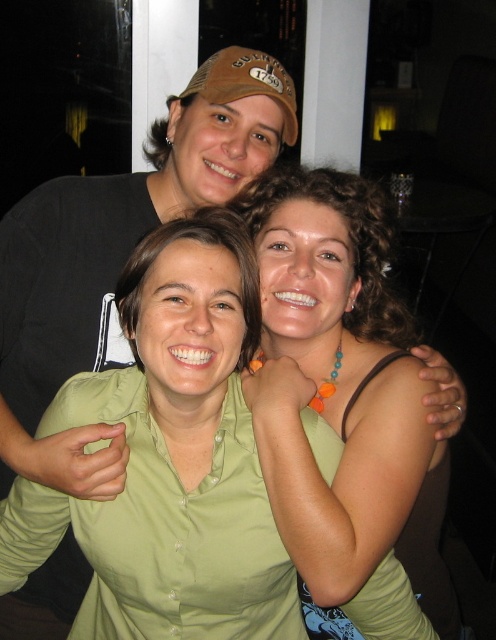
You are trying to take a photo of the brown fabric baseball cap at upper center but the green matte shirt at center is blocking the view. Can you move around to the side to get a clear shot?

The green matte shirt at center is in front of the brown fabric baseball cap at upper center, so moving to the side might allow you to see around the green matte shirt at center and capture the brown fabric baseball cap at upper center without obstruction.

You are trying to identify which green shirt is closer to you in the image. Both the green matte shirt at center and the green fabric shirt at center are visible. According to the scene description, which one is closer?

The green matte shirt at center is positioned under the green fabric shirt at center, so the green fabric shirt at center is closer to you.